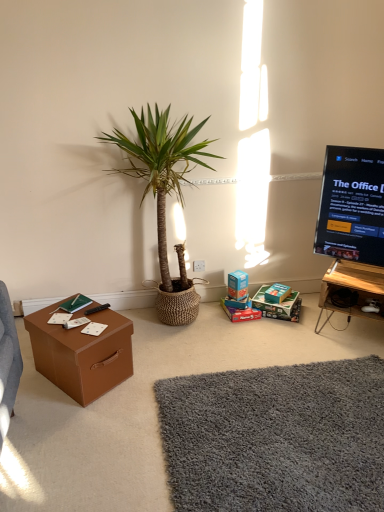
Question: From a real-world perspective, is matte cardboard box at lower center, which ranks as the 3th storage box in right-to-left order, on shaggy gray rug at lower center, which is the first plain in back-to-front order?

Choices:
 (A) yes
 (B) no

Answer: (A)

Question: Does matte cardboard box at lower center, the 1th storage box viewed from the left, lie behind shaggy gray rug at lower center, placed as the 2th plain when sorted from front to back?

Choices:
 (A) no
 (B) yes

Answer: (B)

Question: Considering the relative positions of matte cardboard box at lower center, which ranks as the 3th storage box in right-to-left order, and shaggy gray rug at lower center, which is the first plain in back-to-front order, in the image provided, is matte cardboard box at lower center, which ranks as the 3th storage box in right-to-left order, in front of shaggy gray rug at lower center, which is the first plain in back-to-front order,?

Choices:
 (A) yes
 (B) no

Answer: (B)

Question: Is matte cardboard box at lower center, the 1th storage box viewed from the left, oriented towards shaggy gray rug at lower center, which is the first plain in back-to-front order?

Choices:
 (A) no
 (B) yes

Answer: (B)

Question: From a real-world perspective, is matte cardboard box at lower center, the 1th storage box viewed from the left, physically below shaggy gray rug at lower center, which is the first plain in back-to-front order?

Choices:
 (A) yes
 (B) no

Answer: (B)

Question: Can you confirm if matte cardboard box at lower center, the 1th storage box viewed from the left, is positioned to the left of shaggy gray rug at lower center, which is the first plain in back-to-front order?

Choices:
 (A) yes
 (B) no

Answer: (A)

Question: Considering the relative positions of matte brown storage box at lower right, the 3th storage box from the left, and matte brown cardboard box at center in the image provided, is matte brown storage box at lower right, the 3th storage box from the left, in front of matte brown cardboard box at center?

Choices:
 (A) yes
 (B) no

Answer: (B)

Question: Does matte brown storage box at lower right, the 3th storage box from the left, have a smaller size compared to matte brown cardboard box at center?

Choices:
 (A) no
 (B) yes

Answer: (B)

Question: Does matte brown storage box at lower right, the 3th storage box from the left, touch matte brown cardboard box at center?

Choices:
 (A) yes
 (B) no

Answer: (B)

Question: Is matte brown cardboard box at center a part of matte brown storage box at lower right, the 3th storage box from the left?

Choices:
 (A) yes
 (B) no

Answer: (B)

Question: Can you confirm if matte brown storage box at lower right, the 3th storage box from the left, is taller than matte brown cardboard box at center?

Choices:
 (A) yes
 (B) no

Answer: (B)

Question: Could you tell me if matte brown storage box at lower right, the 3th storage box from the left, is turned towards matte brown cardboard box at center?

Choices:
 (A) yes
 (B) no

Answer: (B)

Question: Is teal cardboard box at center, marked as the 2th storage box in a right-to-left arrangement, completely or partially outside of shaggy gray rug at lower center, placed as the 2th plain when sorted from front to back?

Choices:
 (A) yes
 (B) no

Answer: (A)